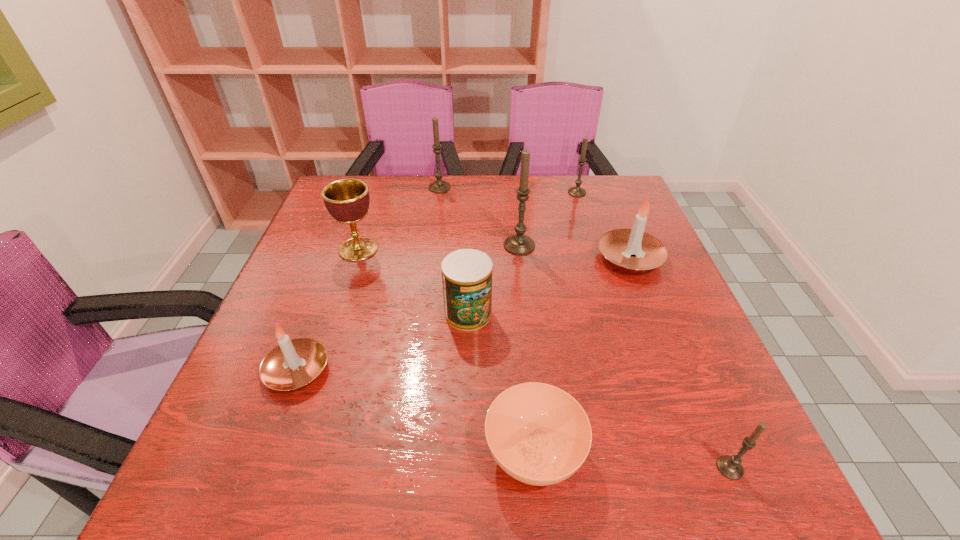
The height and width of the screenshot is (540, 960). Find the location of `the third candle from left to right`. the third candle from left to right is located at coordinates (519, 244).

In order to click on the biggest gray candle in this screenshot , I will do `click(519, 244)`.

You are a GUI agent. You are given a task and a screenshot of the screen. Output one action in this format:
    pyautogui.click(x=<x>, y=<y>)
    Task: Click on the second biggest gray candle
    
    Given the screenshot: What is the action you would take?
    pyautogui.click(x=439, y=186)

This screenshot has height=540, width=960. What are the coordinates of `the third object from left to right` in the screenshot? It's located at (x=439, y=186).

Locate an element on the screen. The image size is (960, 540). the farther white candle is located at coordinates (618, 246).

You are a GUI agent. You are given a task and a screenshot of the screen. Output one action in this format:
    pyautogui.click(x=<x>, y=<y>)
    Task: Click on the right white candle
    Image resolution: width=960 pixels, height=540 pixels.
    Given the screenshot: What is the action you would take?
    pyautogui.click(x=618, y=246)

Find the location of a particular element. the second smallest gray candle is located at coordinates (577, 191).

I want to click on chalice, so click(347, 200).

What are the coordinates of `the sixth farthest object` in the screenshot? It's located at (466, 273).

Identify the location of the second nearest candle. (292, 364).